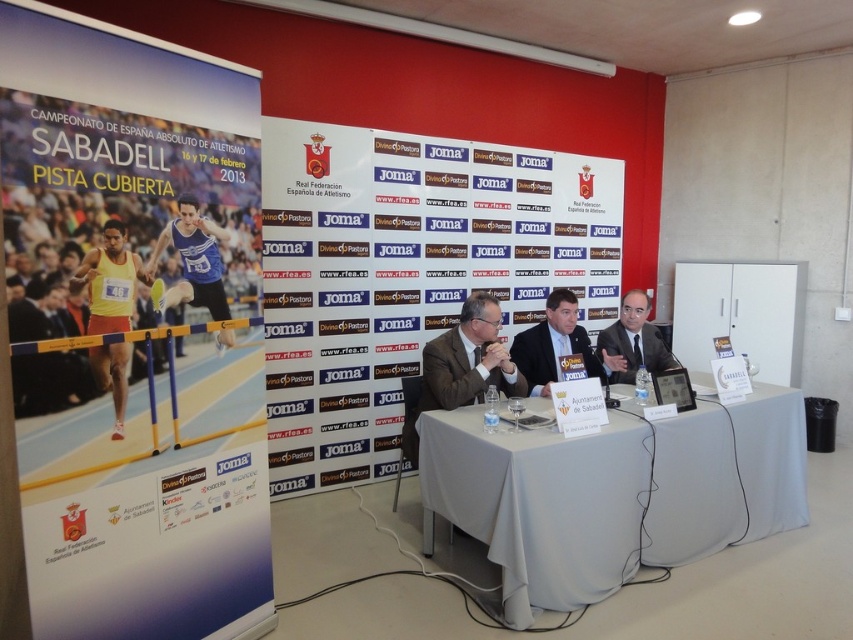
Is point (184, 566) less distant than point (453, 330)?

Yes, point (184, 566) is in front of point (453, 330).

Does point (144, 513) come closer to viewer compared to point (448, 369)?

Yes, point (144, 513) is in front of point (448, 369).

You are a GUI agent. You are given a task and a screenshot of the screen. Output one action in this format:
    pyautogui.click(x=<x>, y=<y>)
    Task: Click on the white paper at left
    
    Given the screenshot: What is the action you would take?
    pyautogui.click(x=155, y=554)

Is point (584, 492) behind point (160, 476)?

Yes.

Is point (573, 545) farther from viewer compared to point (50, 566)?

Yes, it is behind point (50, 566).

Image resolution: width=853 pixels, height=640 pixels. I want to click on white cloth-covered table at center, so click(613, 492).

Is blue jersey at center above matte black suit at center?

Yes.

Can you confirm if blue jersey at center is shorter than matte black suit at center?

Yes, blue jersey at center is shorter than matte black suit at center.

Who is more distant from viewer, [213,227] or [630,362]?

Point [630,362]

Where is `blue jersey at center`? blue jersey at center is located at coordinates click(x=193, y=259).